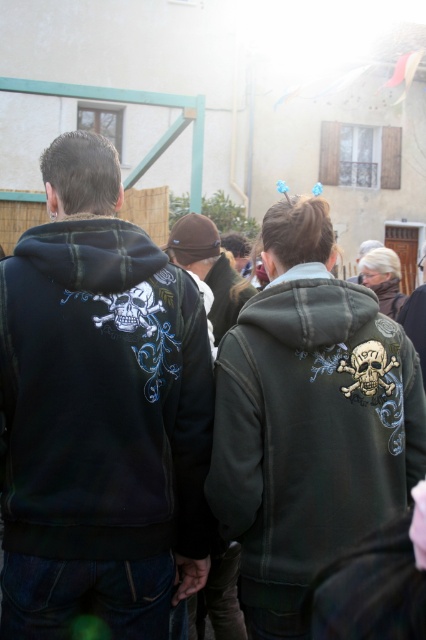
You are standing at the origin point in the image. The dark green hoodie with skull design at center is located at coordinates 0.666, 0.732. If you want to move towards it, which direction should you head?

The dark green hoodie with skull design at center is located at coordinates (311, 426). Since the x and y coordinates are both greater than 0.5, you should move towards the upper right direction to reach it.

You are a photographer trying to capture a group shot of the black matte hoodie at left and the dark green hoodie with skull design at center. The camera you are using has a minimum focus distance of 15 inches. Can you take a photo of both subjects without moving either of them?

The black matte hoodie at left is 17.26 inches from the dark green hoodie with skull design at center. Since the camera has a minimum focus distance of 15 inches, the photographer can take a photo of both subjects without moving them because the distance between them is within the camera range.